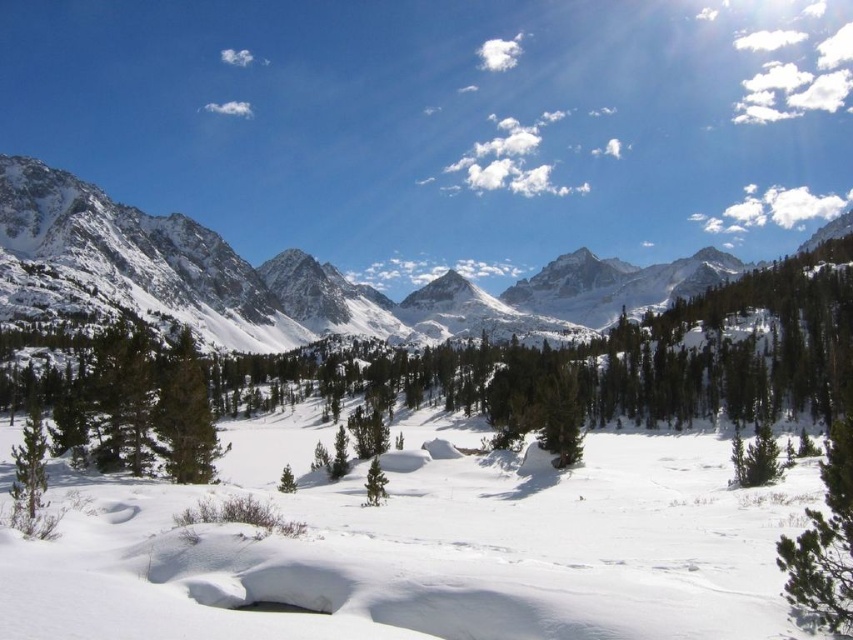
You are standing in the winter landscape and want to take a photo. You notice two points marked in the image. Which point is nearer to you, point at coordinates point (374, 605) or point at coordinates point (756, 268)?

Point point (374, 605) is closer to the camera than point point (756, 268), so the point at coordinates point (374, 605) is nearer to you.

You are standing in the winter landscape and want to place a small red flag exactly at the center of the image. However, there is already white fluffy snow at center. Where should you place the flag to ensure it is as close as possible to the true center without overlapping the snow?

The white fluffy snow at center is located at point (426, 548), so you should place the flag slightly to the left and slightly lower than that position to be closest to the true center without overlapping the snow.